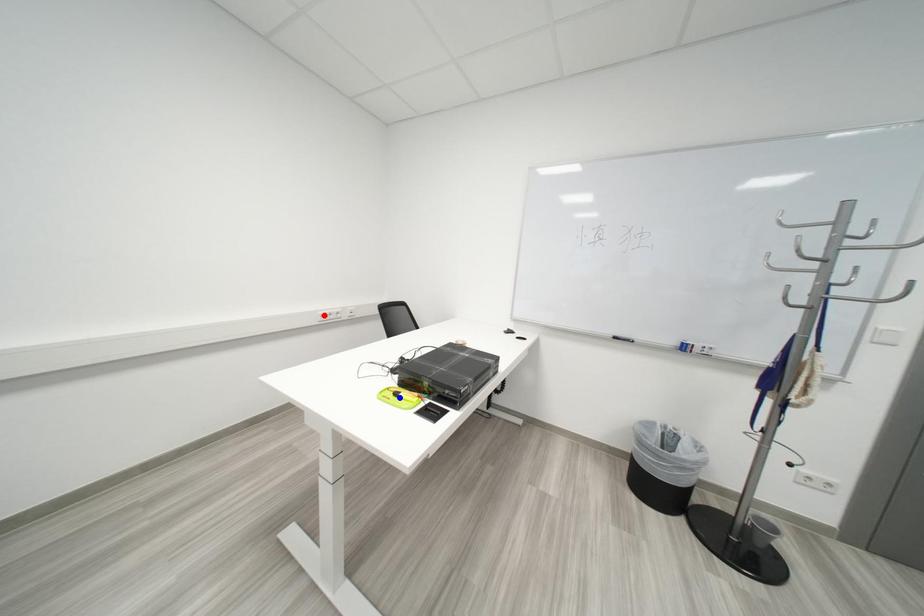
Question: Which of the two points in the image is closer to the camera?

Choices:
 (A) Blue point is closer.
 (B) Red point is closer.

Answer: (A)